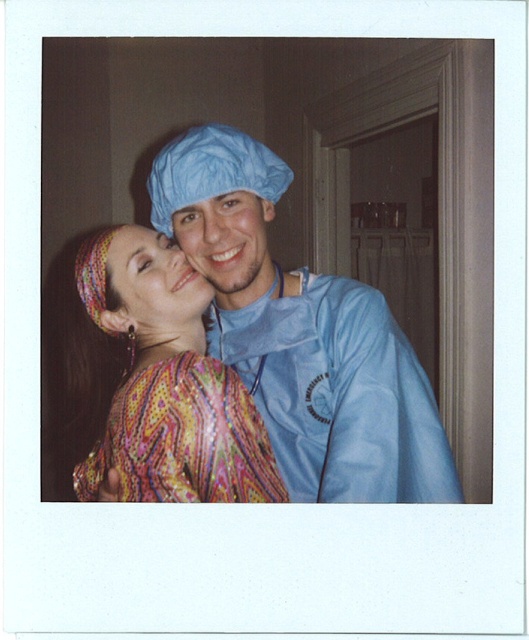
You are a photographer trying to capture a closeup shot of both the multicolored patterned dress at center and the blue fabric face at center. Since you want both subjects to appear similarly sized in the photo, which subject should you move closer to the camera?

The blue fabric face at center should be moved closer to the camera because it is smaller in size than the multicolored patterned dress at center. By moving the smaller object closer, they will appear similar in size in the photo.